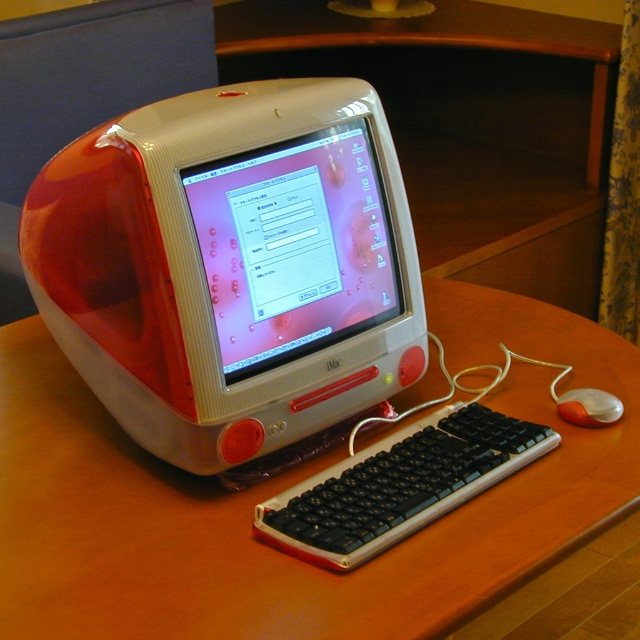
Can you confirm if white glossy monitor at center is positioned below orange matte mouse at lower right?

Actually, white glossy monitor at center is above orange matte mouse at lower right.

This screenshot has width=640, height=640. I want to click on white glossy monitor at center, so click(294, 246).

Where is `white glossy monitor at center`? white glossy monitor at center is located at coordinates (294, 246).

Which is more to the right, white glossy monitor at center or black plastic keyboard at center?

black plastic keyboard at center is more to the right.

Between point (296, 305) and point (388, 541), which one is positioned in front?

Positioned in front is point (388, 541).

Does point (400, 300) come in front of point (385, 442)?

That is False.

The image size is (640, 640). In order to click on white glossy monitor at center in this screenshot , I will do `click(294, 246)`.

Based on the photo, who is lower down, translucent red plastic imac at center or orange matte mouse at lower right?

Positioned lower is orange matte mouse at lower right.

Does translucent red plastic imac at center appear on the left side of orange matte mouse at lower right?

Correct, you'll find translucent red plastic imac at center to the left of orange matte mouse at lower right.

The width and height of the screenshot is (640, 640). In order to click on translucent red plastic imac at center in this screenshot , I will do `click(230, 266)`.

Identify the location of translucent red plastic imac at center. The height and width of the screenshot is (640, 640). (230, 266).